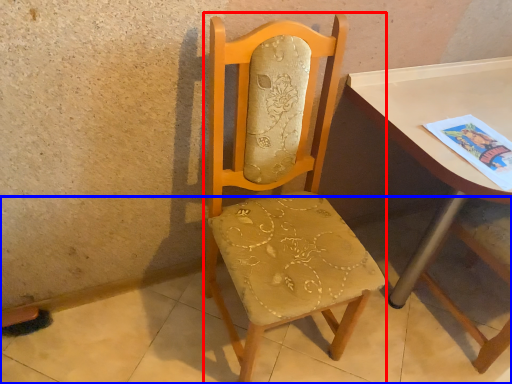
Question: Which object is closer to the camera taking this photo, chair (highlighted by a red box) or concrete (highlighted by a blue box)?

Choices:
 (A) chair
 (B) concrete

Answer: (A)